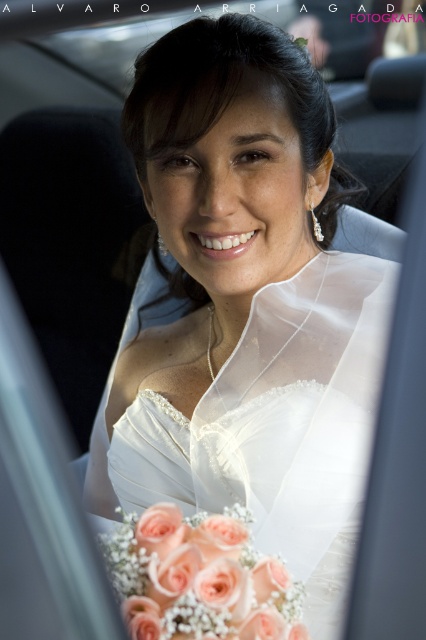
Question: Can you confirm if white satin wedding dress at center is bigger than peachy silk bouquet at center?

Choices:
 (A) no
 (B) yes

Answer: (B)

Question: Among these points, which one is farthest from the camera?

Choices:
 (A) (310, 490)
 (B) (235, 509)

Answer: (A)

Question: In this image, where is white satin wedding dress at center located relative to peachy silk bouquet at center?

Choices:
 (A) above
 (B) below

Answer: (A)

Question: Does white satin wedding dress at center appear over peachy silk bouquet at center?

Choices:
 (A) yes
 (B) no

Answer: (A)